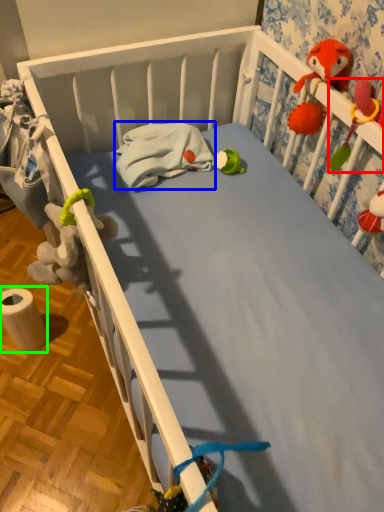
Question: Which object is positioned farthest from toy (highlighted by a red box)? Select from material (highlighted by a blue box) and toilet paper (highlighted by a green box).

Choices:
 (A) material
 (B) toilet paper

Answer: (B)